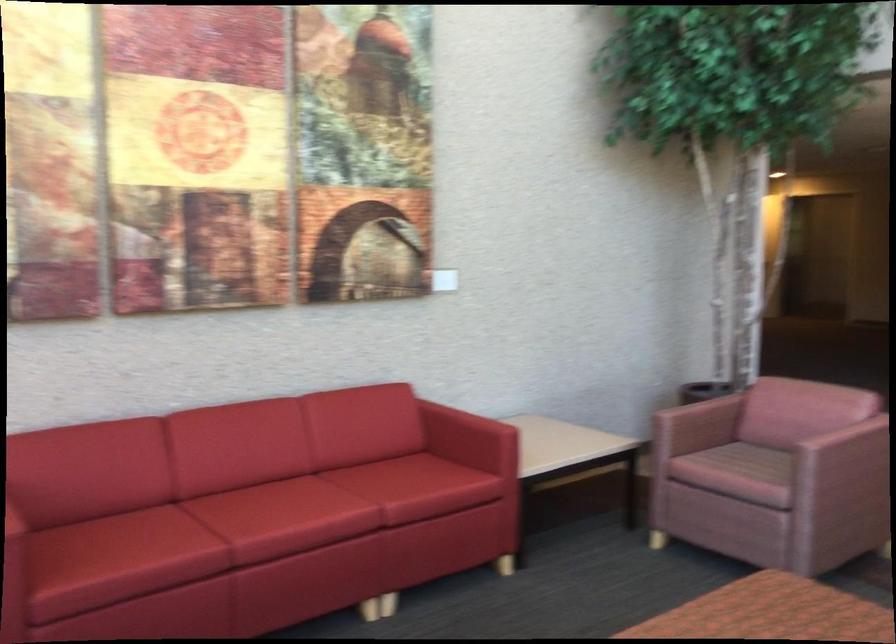
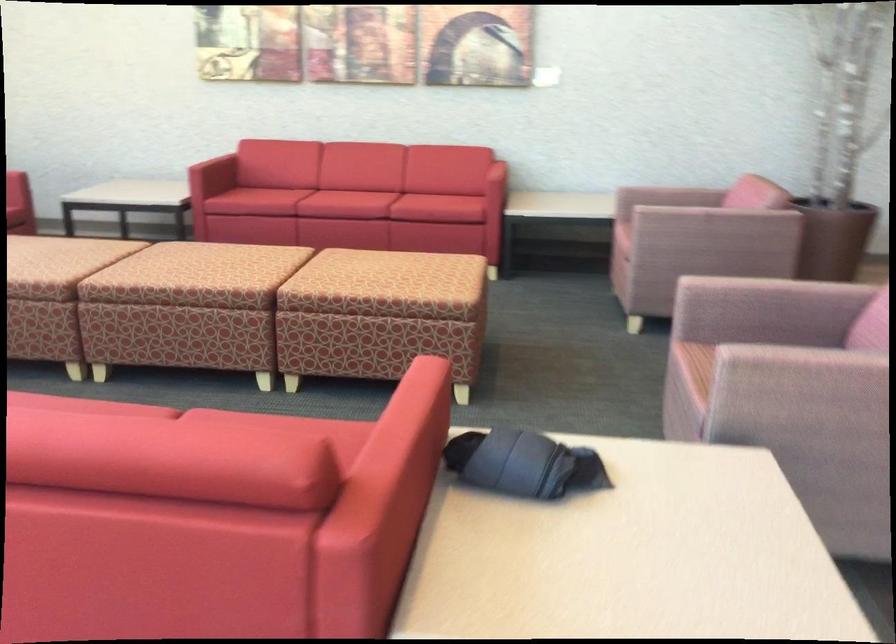
Locate, in the second image, the point that corresponds to point 513,444 in the first image.

(490, 173)